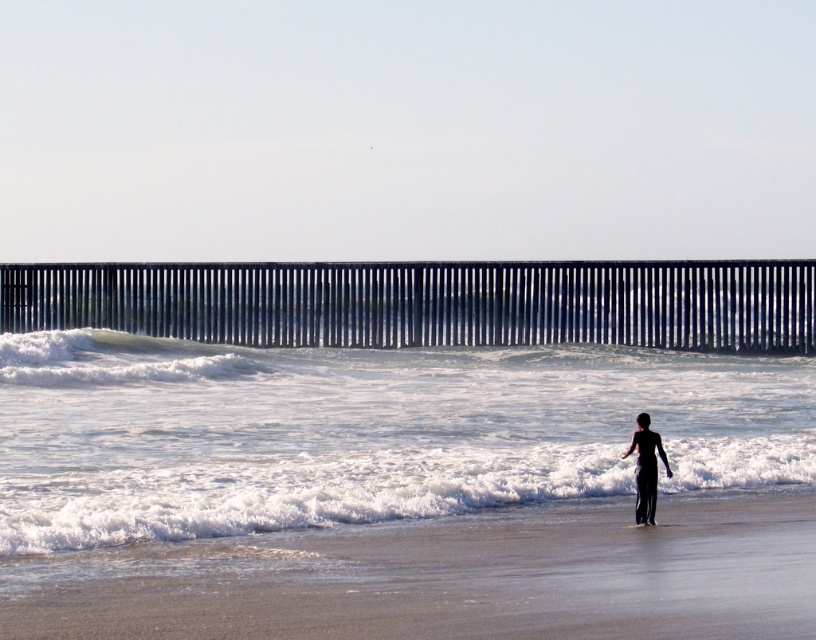
Which of these two, white frothy water at center or sandy beach at lower center, stands shorter?

sandy beach at lower center is shorter.

Which is behind, point (694, 461) or point (189, 577)?

Point (694, 461)

Is point (160, 433) positioned before point (98, 604)?

No, (160, 433) is further to viewer.

Image resolution: width=816 pixels, height=640 pixels. What are the coordinates of `white frothy water at center` in the screenshot? It's located at (362, 433).

Between black matte wetsuit at center and white foam surfboard at lower center, which one has less height?

white foam surfboard at lower center is shorter.

Is black matte wetsuit at center thinner than white foam surfboard at lower center?

No, black matte wetsuit at center is not thinner than white foam surfboard at lower center.

The height and width of the screenshot is (640, 816). Describe the element at coordinates (646, 467) in the screenshot. I see `black matte wetsuit at center` at that location.

Find the location of a particular element. This screenshot has height=640, width=816. black matte wetsuit at center is located at coordinates (646, 467).

Between white foamy wave at center and white foam surfboard at lower center, which one is positioned higher?

white foamy wave at center is higher up.

From the picture: Is white foamy wave at center shorter than white foam surfboard at lower center?

Incorrect, white foamy wave at center's height does not fall short of white foam surfboard at lower center's.

Which is behind, point (140, 372) or point (639, 525)?

Positioned behind is point (140, 372).

Image resolution: width=816 pixels, height=640 pixels. Identify the location of white foamy wave at center. (112, 358).